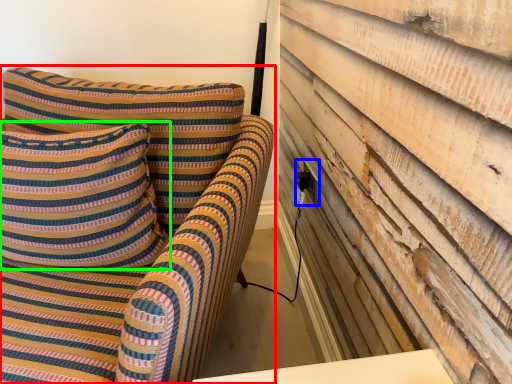
Question: Based on their relative distances, which object is nearer to furniture (highlighted by a red box)? Choose from electric outlet (highlighted by a blue box) and pillow (highlighted by a green box).

Choices:
 (A) electric outlet
 (B) pillow

Answer: (B)